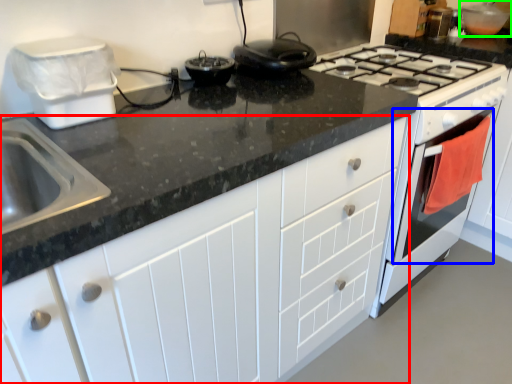
Question: Based on their relative distances, which object is farther from cabinetry (highlighted by a red box)? Choose from oven (highlighted by a blue box) and appliance (highlighted by a green box).

Choices:
 (A) oven
 (B) appliance

Answer: (B)